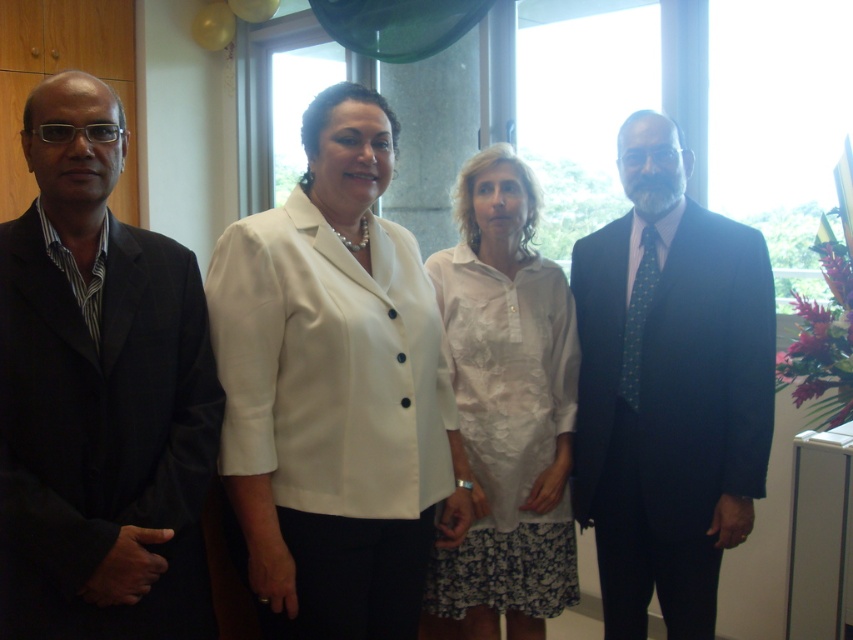
Question: Which point is farther to the camera?

Choices:
 (A) (612, 257)
 (B) (403, 593)

Answer: (A)

Question: Among these objects, which one is farthest from the camera?

Choices:
 (A) black matte suit at left
 (B) white matte blazer at center
 (C) white cotton shirt at center

Answer: (C)

Question: Which of the following is the farthest from the observer?

Choices:
 (A) (120, 310)
 (B) (459, 586)
 (C) (762, 296)
 (D) (320, 365)

Answer: (B)

Question: Does white matte blazer at center appear over white cotton shirt at center?

Choices:
 (A) no
 (B) yes

Answer: (B)

Question: Does white matte blazer at center have a smaller size compared to dark blue suit at center?

Choices:
 (A) yes
 (B) no

Answer: (B)

Question: Can you confirm if black matte suit at left is positioned above dark blue suit at center?

Choices:
 (A) no
 (B) yes

Answer: (B)